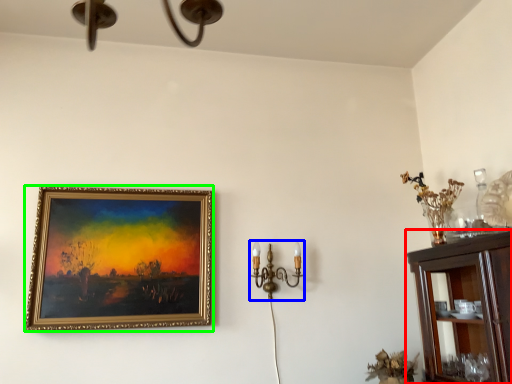
Question: Considering the real-world distances, which object is closest to cabinetry (highlighted by a red box)? candle holder (highlighted by a blue box) or picture frame (highlighted by a green box).

Choices:
 (A) candle holder
 (B) picture frame

Answer: (A)